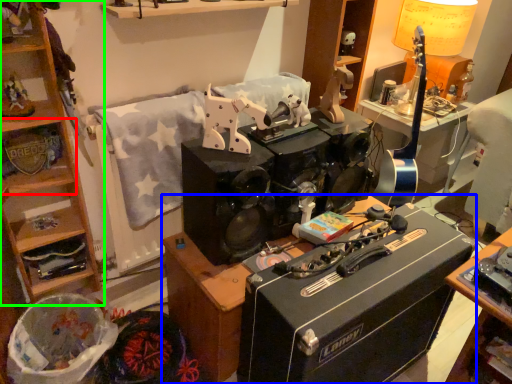
Question: Which is farther away from shelf (highlighted by a red box)? desk (highlighted by a blue box) or cabinetry (highlighted by a green box)?

Choices:
 (A) desk
 (B) cabinetry

Answer: (A)